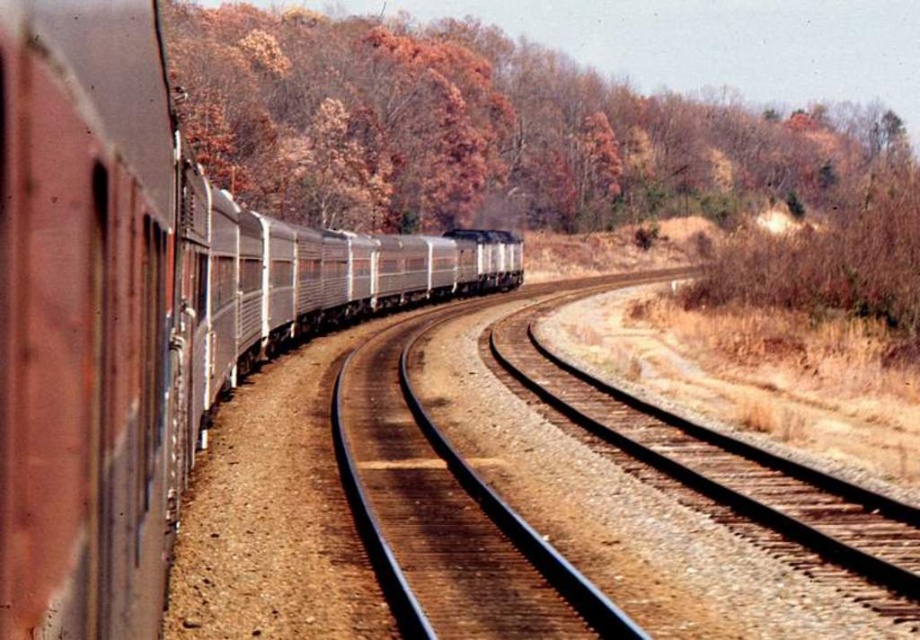
Question: Among these points, which one is farthest from the camera?

Choices:
 (A) (213, 125)
 (B) (66, 241)

Answer: (A)

Question: Considering the relative positions of silver metallic train at left and brown leafy trees at upper center in the image provided, where is silver metallic train at left located with respect to brown leafy trees at upper center?

Choices:
 (A) left
 (B) right

Answer: (A)

Question: Does silver metallic train at left have a smaller size compared to metal/smooth track at center?

Choices:
 (A) yes
 (B) no

Answer: (B)

Question: Which object is positioned closest to the brown leafy trees at upper center?

Choices:
 (A) silver metallic train at left
 (B) metal/smooth track at center

Answer: (A)

Question: Based on their relative distances, which object is farther from the silver metallic train at left?

Choices:
 (A) metal/smooth track at center
 (B) brown leafy trees at upper center

Answer: (B)

Question: Is silver metallic train at left positioned before brown leafy trees at upper center?

Choices:
 (A) no
 (B) yes

Answer: (B)